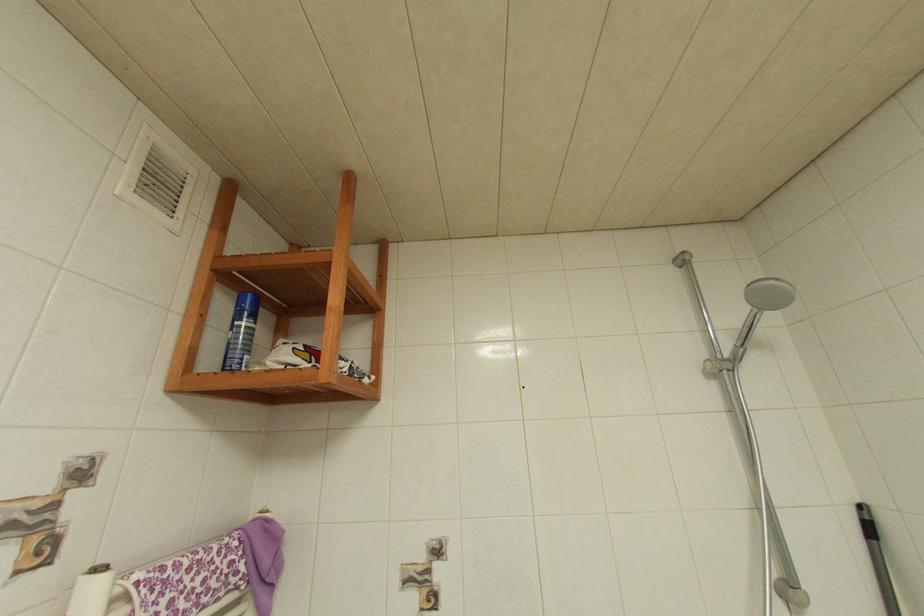
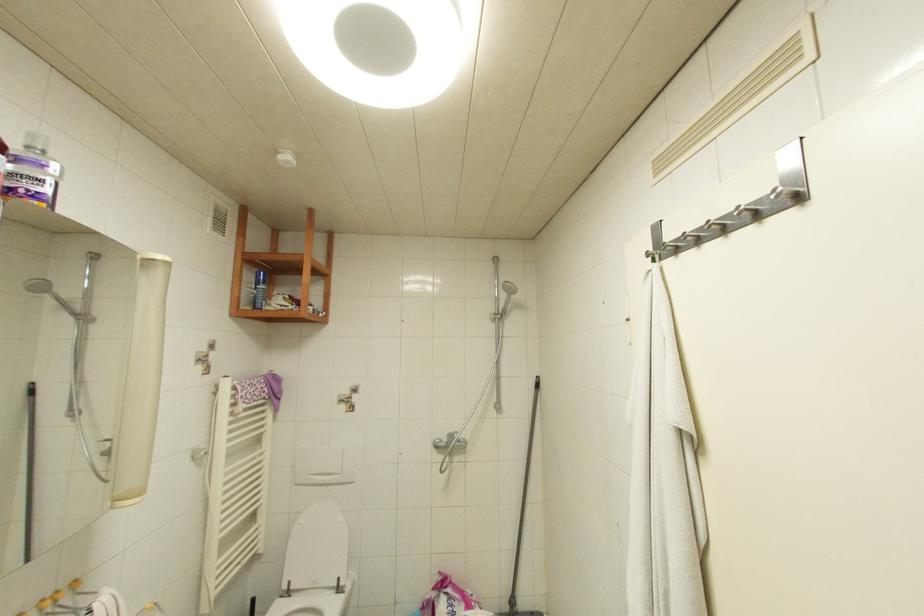
Question: The images are taken continuously from a first-person perspective. In which direction are you moving?

Choices:
 (A) Left
 (B) Right
 (C) Forward
 (D) Backward

Answer: (D)